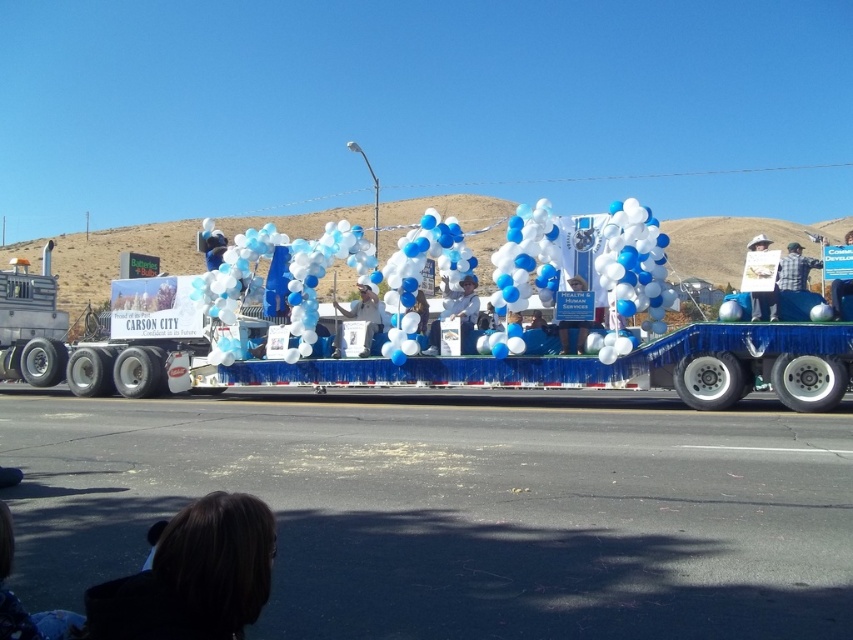
You are a photographer at the Carson City parade. You want to take a photo of the white plush hat at center. Where should you aim your camera to capture it?

You should aim your camera at point 0.489 on the horizontal axis and 0.535 on the vertical axis to capture the white plush hat at center.